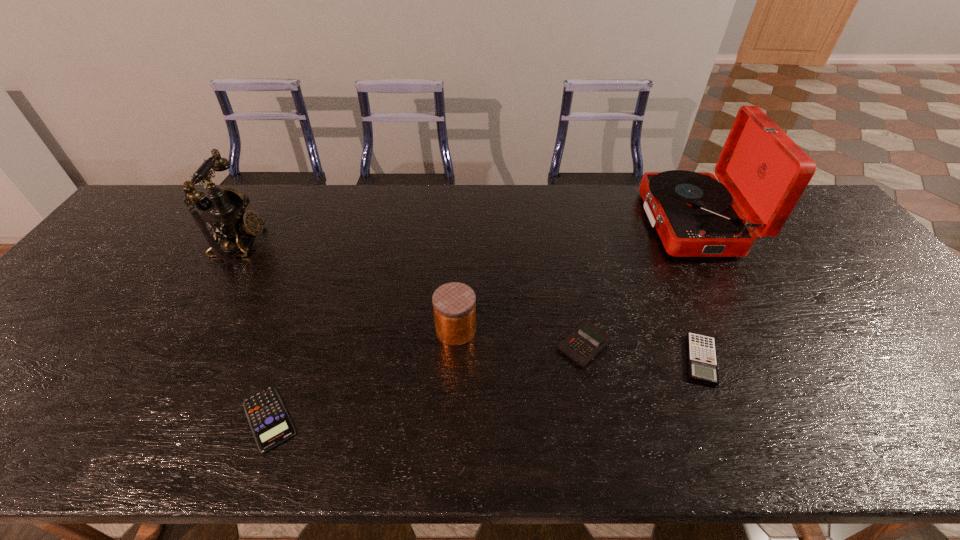
Find the location of a particular element. This screenshot has height=540, width=960. telephone that is at the far edge is located at coordinates (223, 208).

I want to click on object at the near edge, so click(270, 423).

You are a GUI agent. You are given a task and a screenshot of the screen. Output one action in this format:
    pyautogui.click(x=<x>, y=<y>)
    Task: Click on the vacant space at the far edge
    
    Given the screenshot: What is the action you would take?
    pyautogui.click(x=454, y=191)

You are a GUI agent. You are given a task and a screenshot of the screen. Output one action in this format:
    pyautogui.click(x=<x>, y=<y>)
    Task: Click on the vacant area at the near edge
    The image size is (960, 540).
    Given the screenshot: What is the action you would take?
    (x=390, y=427)

The image size is (960, 540). What are the coordinates of `vacant space at the left edge of the desktop` in the screenshot? It's located at (5, 394).

I want to click on blank area at the right edge, so click(x=814, y=252).

I want to click on vacant area at the near left corner, so click(9, 444).

Identify the location of unoccupied position between the second tallest calculator and the fourth tallest object. (642, 352).

Locate an element on the screen. The width and height of the screenshot is (960, 540). free point between the leftmost calculator and the tallest calculator is located at coordinates (426, 381).

Where is `empty space that is in between the telephone and the jar`? The width and height of the screenshot is (960, 540). empty space that is in between the telephone and the jar is located at coordinates (348, 287).